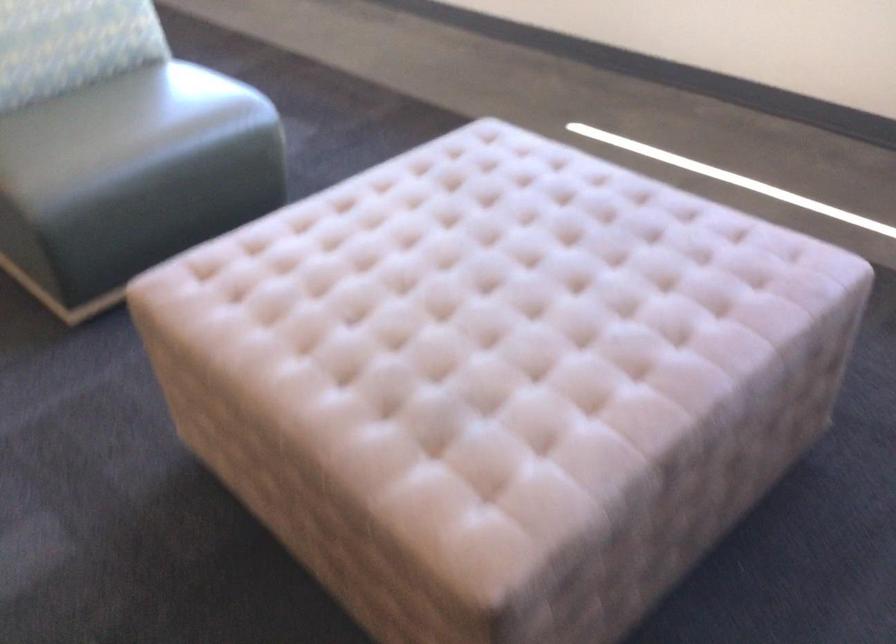
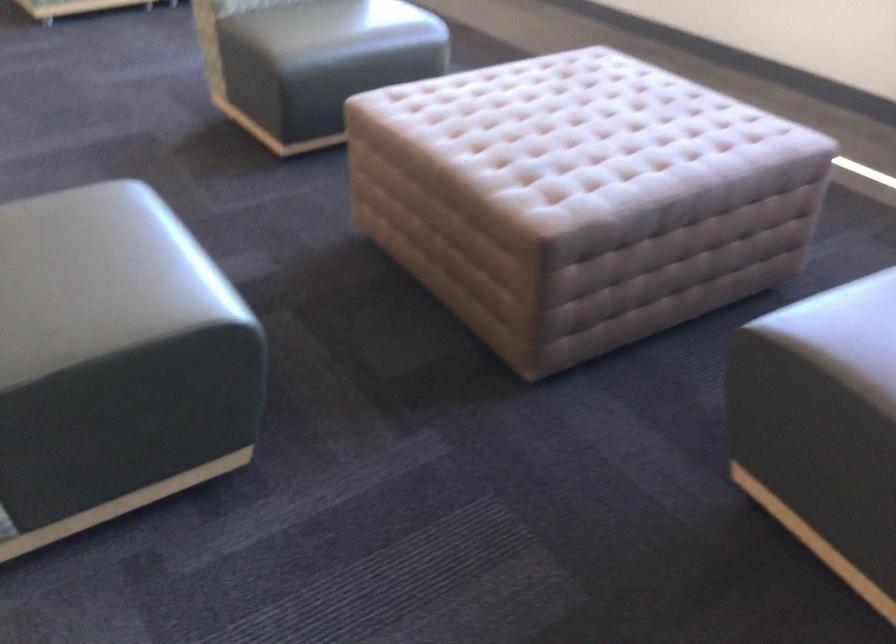
In the second image, find the point that corresponds to (x=506, y=346) in the first image.

(586, 147)